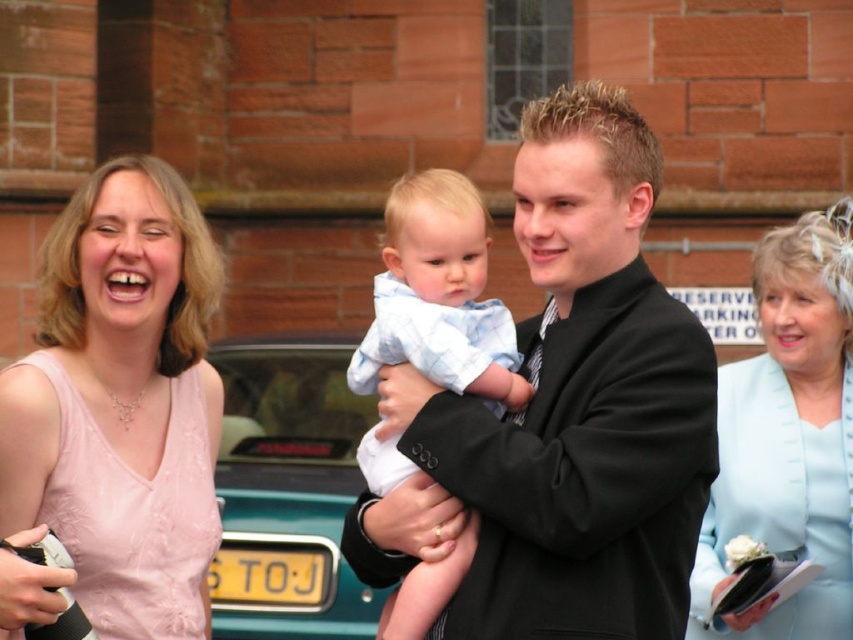
You are standing in front of the scene and want to take a photo of both the pink satin dress at upper left and the light blue cotton shirt at center. Which object is shorter in height?

The pink satin dress at upper left is shorter in height than the light blue cotton shirt at center.

You are an event planner organizing a photoshoot for a fashion show. You have two items to place on a mannequin stand that can only accommodate one item at a time. The stand has a height limit of 1.2 meters. Given the light blue satin dress at center and the light blue cotton shirt at center, which item would you choose to place on the stand without exceeding the height limit?

The light blue satin dress at center has a lesser height compared to the light blue cotton shirt at center. Therefore, the light blue satin dress at center would be the better choice as it is shorter and less likely to exceed the stand height limit of 1.2 meters.

You are at a fashion show and need to arrange outfits based on their position. Which item is positioned lower between the light blue satin dress at center and the light blue cotton shirt at center?

The light blue satin dress at center is positioned lower than the light blue cotton shirt at center.